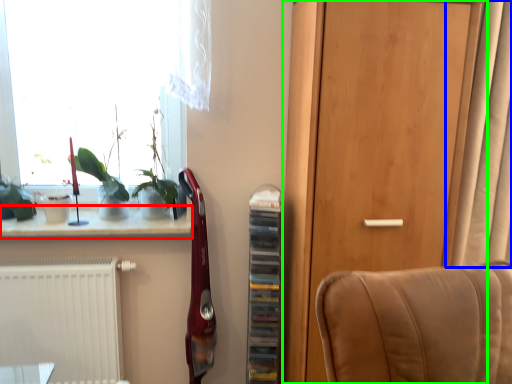
Question: Based on their relative distances, which object is farther from window sill (highlighted by a red box)? Choose from curtain (highlighted by a blue box) and door (highlighted by a green box).

Choices:
 (A) curtain
 (B) door

Answer: (A)